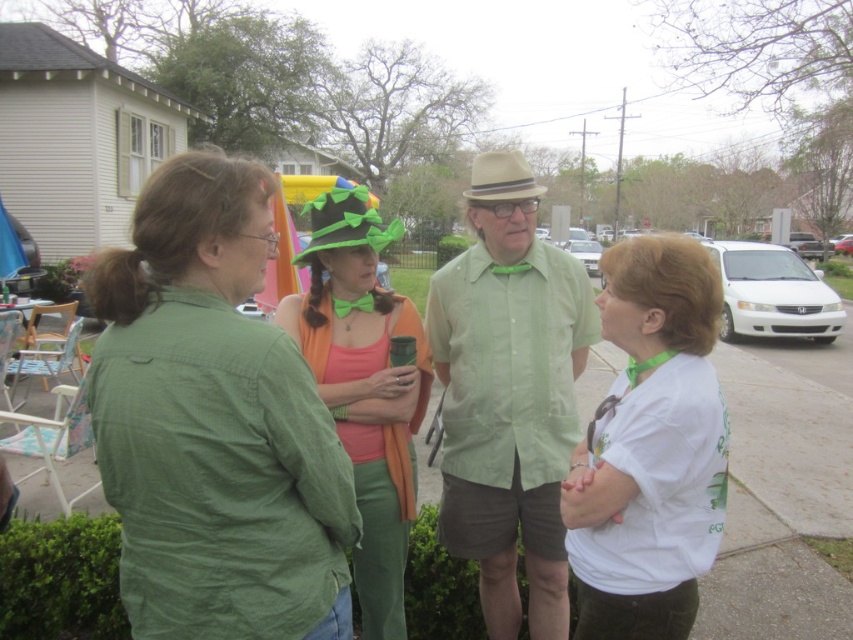
You are a photographer at the event and want to capture a photo of the green cotton shirt at center and the green felt hat at center. Which object should you focus on first if you want to ensure both are in the frame without moving the camera?

The green cotton shirt at center is much taller than the green felt hat at center, so you should focus on the taller green cotton shirt at center first to ensure it fits within the frame.

Based on the photo, you are organizing a small outdoor event and want to ensure that the green cotton shirt at center and the green felt hat at center are displayed together. Since space is limited, which item should you prioritize placing first to accommodate both?

The green cotton shirt at center occupies less space than the green felt hat at center, so you should prioritize placing the green felt hat at center first to ensure there is enough space for both items.

You are a photographer at the event and want to take a photo that includes both the green cotton shirt at center and the green felt hat at center. Since the hat is part of the person, will you need to adjust your camera angle to ensure both are visible in the frame?

The green cotton shirt at center is below green felt hat at center, so the hat is likely on top of the shirt. Since the hat is part of the person wearing the shirt, adjusting the camera angle slightly upward might help ensure both are visible in the frame.